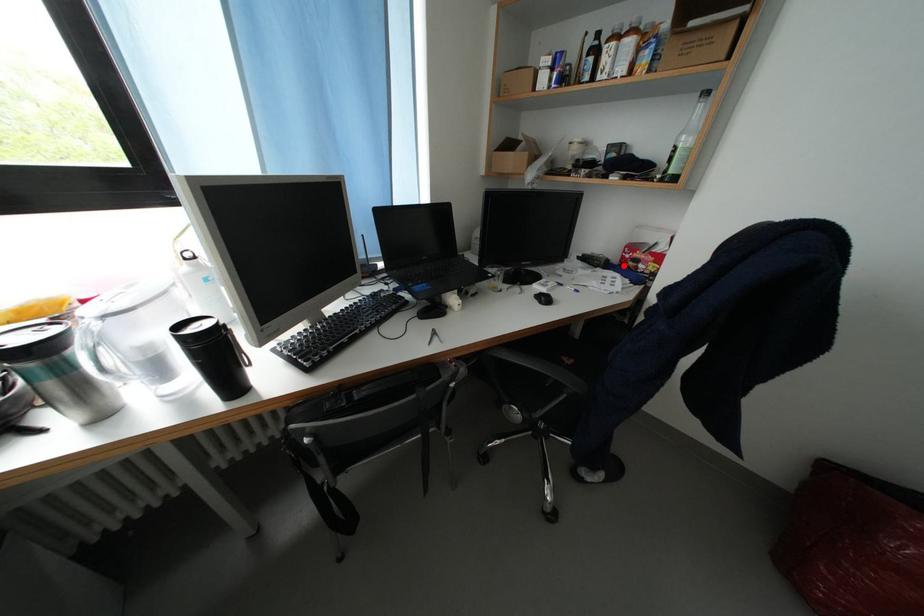
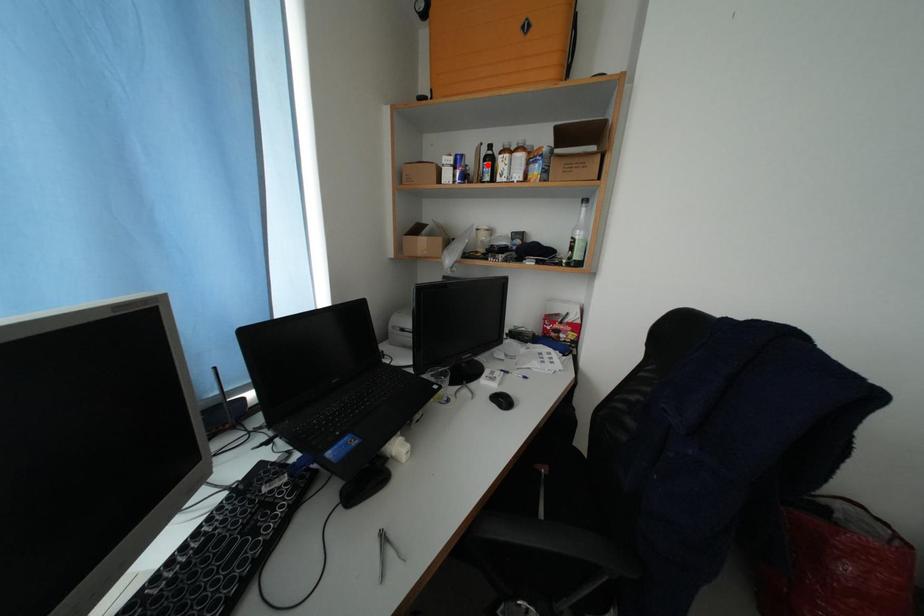
I am providing you with two images of the same scene from different viewpoints. A red point is marked on the first image and another point is marked on the second image. Is the red point in image1 aligned with the point shown in image2?

No